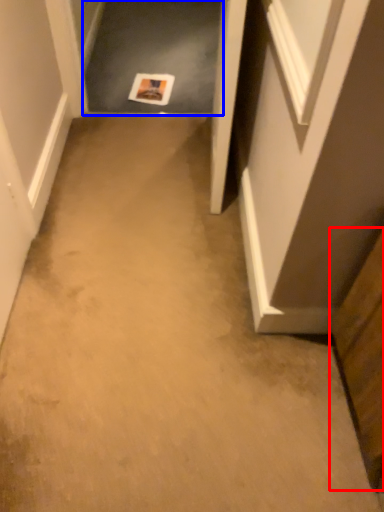
Question: Which object appears farthest to the camera in this image, cabinetry (highlighted by a red box) or passage (highlighted by a blue box)?

Choices:
 (A) cabinetry
 (B) passage

Answer: (B)